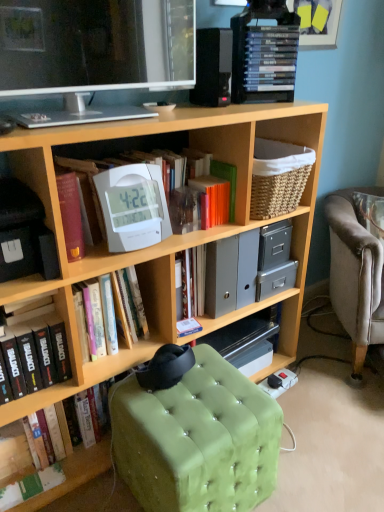
Question: Considering the relative sizes of black matte book at lower left, which is the fourth book in top-to-bottom order, and gray plastic file folders at center in the image provided, is black matte book at lower left, which is the fourth book in top-to-bottom order, wider than gray plastic file folders at center?

Choices:
 (A) yes
 (B) no

Answer: (B)

Question: Is black matte book at lower left, marked as the second book in a bottom-to-top arrangement, facing away from gray plastic file folders at center?

Choices:
 (A) yes
 (B) no

Answer: (B)

Question: Does black matte book at lower left, marked as the second book in a bottom-to-top arrangement, have a lesser width compared to gray plastic file folders at center?

Choices:
 (A) no
 (B) yes

Answer: (B)

Question: From a real-world perspective, is black matte book at lower left, marked as the second book in a bottom-to-top arrangement, under gray plastic file folders at center?

Choices:
 (A) yes
 (B) no

Answer: (A)

Question: Considering the relative sizes of black matte book at lower left, which is the fourth book in top-to-bottom order, and gray plastic file folders at center in the image provided, is black matte book at lower left, which is the fourth book in top-to-bottom order, smaller than gray plastic file folders at center?

Choices:
 (A) yes
 (B) no

Answer: (A)

Question: Looking at the image, does wooden bookcase at center seem bigger or smaller compared to green paper book at lower left, acting as the 5th book starting from the top?

Choices:
 (A) big
 (B) small

Answer: (A)

Question: Visually, is wooden bookcase at center positioned to the left or to the right of green paper book at lower left, acting as the 5th book starting from the top?

Choices:
 (A) left
 (B) right

Answer: (B)

Question: Is wooden bookcase at center inside or outside of green paper book at lower left, which appears as the 1th book when ordered from the bottom?

Choices:
 (A) inside
 (B) outside

Answer: (B)

Question: From a real-world perspective, is wooden bookcase at center physically located above or below green paper book at lower left, acting as the 5th book starting from the top?

Choices:
 (A) below
 (B) above

Answer: (B)

Question: Considering their positions, is white plastic clock at upper center located in front of or behind white plastic clock at upper center, the 3th book positioned from the bottom?

Choices:
 (A) behind
 (B) front

Answer: (B)

Question: From a real-world perspective, is white plastic clock at upper center above or below white plastic clock at upper center, the 3th book positioned from the bottom?

Choices:
 (A) below
 (B) above

Answer: (B)

Question: Would you say white plastic clock at upper center is to the left or to the right of white plastic clock at upper center, the 3th book positioned from the bottom, in the picture?

Choices:
 (A) left
 (B) right

Answer: (B)

Question: Is white plastic clock at upper center situated inside white plastic clock at upper center, the third book in the top-to-bottom sequence, or outside?

Choices:
 (A) outside
 (B) inside

Answer: (A)

Question: Is black matte book at lower left, which is the fourth book in top-to-bottom order, bigger or smaller than white plastic clock at center, the fourth book in the bottom-to-top sequence?

Choices:
 (A) small
 (B) big

Answer: (A)

Question: Do you think black matte book at lower left, which is the fourth book in top-to-bottom order, is within white plastic clock at center, arranged as the second book when viewed from the top, or outside of it?

Choices:
 (A) inside
 (B) outside

Answer: (B)